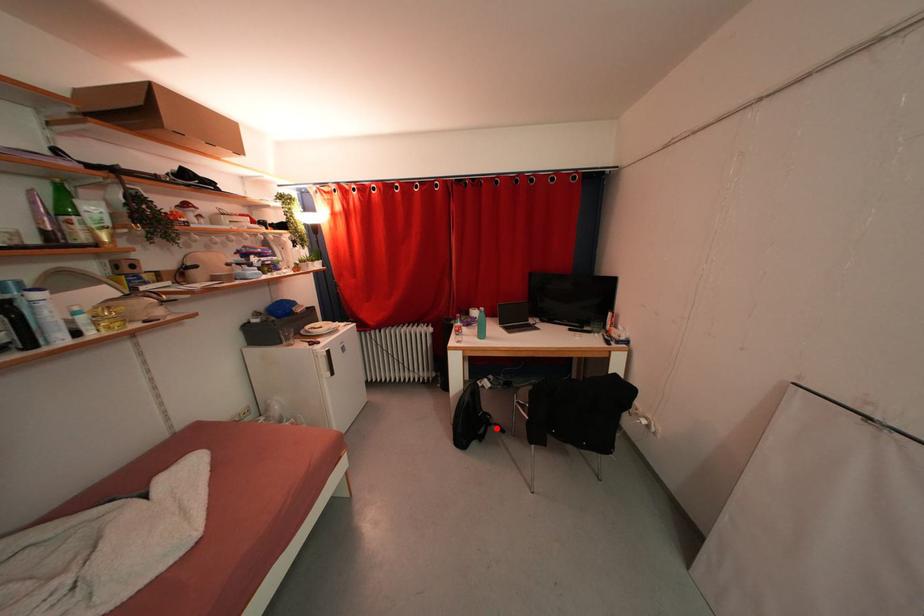
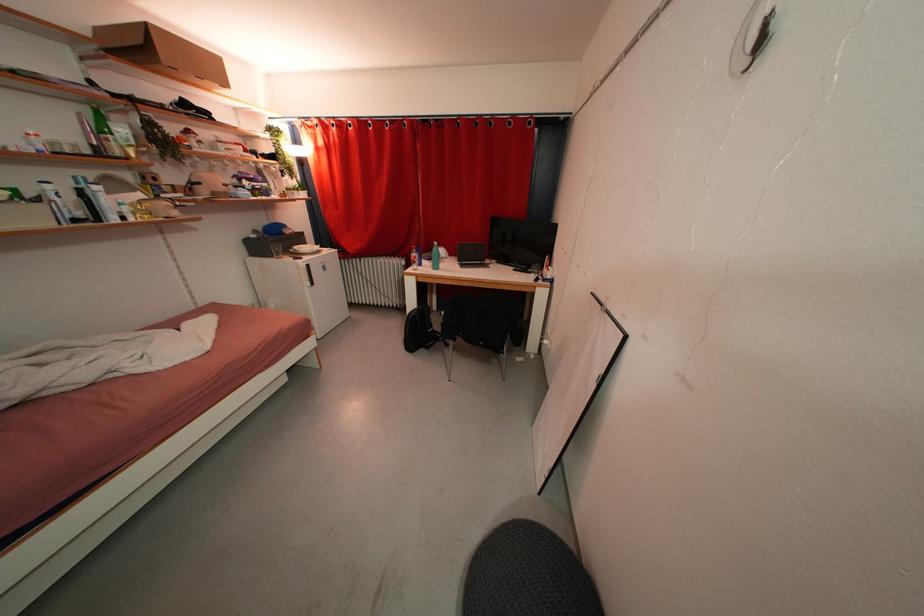
Find the pixel in the second image that matches the highlighted location in the first image.

(444, 344)